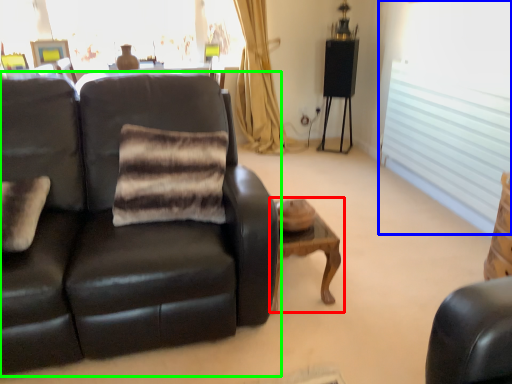
Question: Which object is the closest to the table (highlighted by a red box)? Choose among these: window (highlighted by a blue box) or studio couch (highlighted by a green box).

Choices:
 (A) window
 (B) studio couch

Answer: (B)